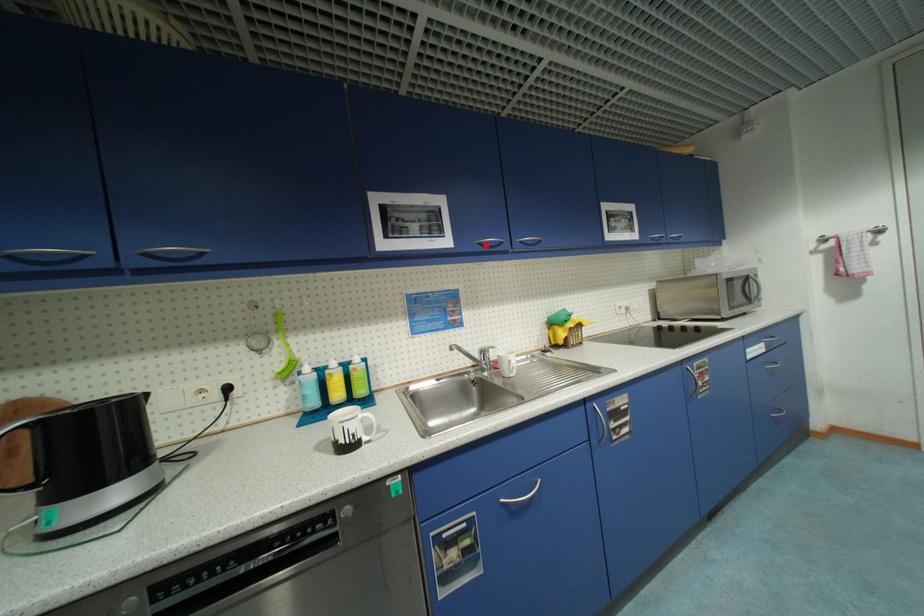
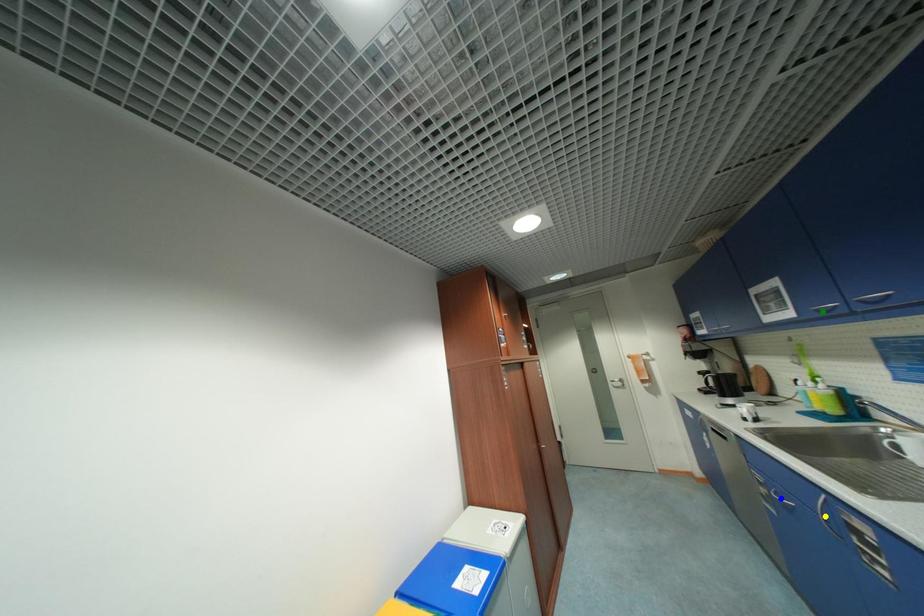
Question: I am providing you with two images of the same scene from different viewpoints. A red point is marked on the first image. You are given multiple points on the second image. Which spot in image 2 lines up with the point in image 1?

Choices:
 (A) blue point
 (B) yellow point
 (C) green point

Answer: (C)